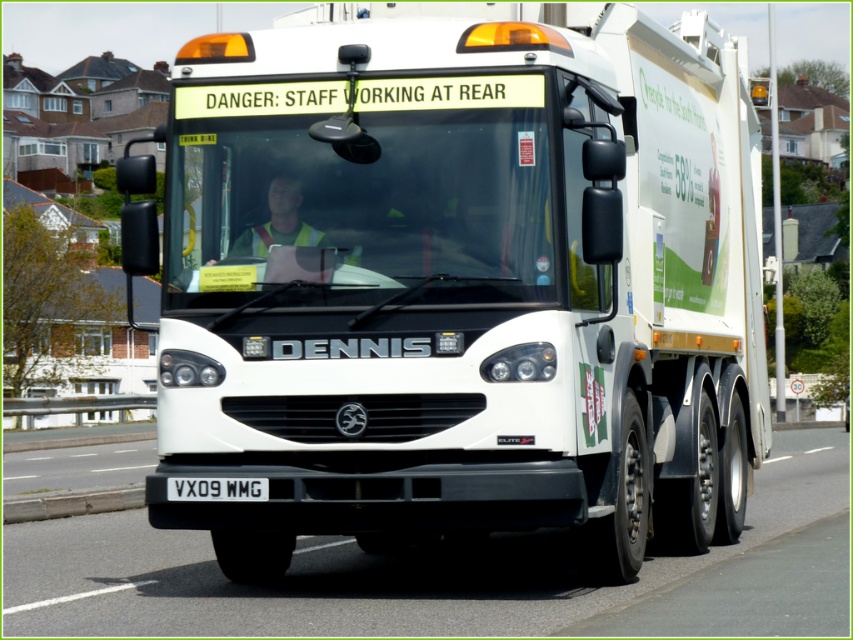
You are standing at a point 10 meters away from the refuse collection vehicle. You want to approach the vehicle to check the license plate. Is the point at coordinate point (688, 72) closer to you than the license plate?

The distance of point (688, 72) from viewer is 12.26 meters. Since you are standing 10 meters away, the point is farther away than your current position. Therefore, the license plate is closer to you than the point.

You are a pedestrian standing in front of the Dennis Elite refuse collection vehicle. You notice two points marked on the truck. The first point is at coordinate point [4,512] and the second at point [223,490]. Which point is closer to you?

Point [223,490] is closer to you because point [4,512] is further away from the camera than point [223,490].